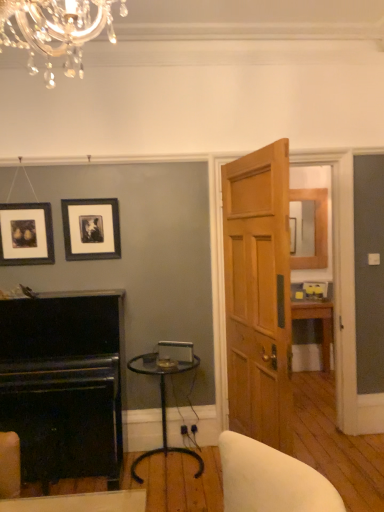
Question: Is matte black picture frame at upper left, the second picture frame positioned from the right, thinner than clear glass table at center?

Choices:
 (A) no
 (B) yes

Answer: (B)

Question: Does matte black picture frame at upper left, the second picture frame positioned from the right, have a greater height compared to clear glass table at center?

Choices:
 (A) yes
 (B) no

Answer: (B)

Question: Is the depth of matte black picture frame at upper left, the second picture frame positioned from the right, less than that of clear glass table at center?

Choices:
 (A) yes
 (B) no

Answer: (B)

Question: From the image's perspective, is matte black picture frame at upper left, the second picture frame positioned from the right, under clear glass table at center?

Choices:
 (A) no
 (B) yes

Answer: (A)

Question: Is matte black picture frame at upper left, the second picture frame positioned from the right, outside clear glass table at center?

Choices:
 (A) yes
 (B) no

Answer: (A)

Question: Is matte black picture frame at upper left, the second picture frame positioned from the right, further to the viewer compared to clear glass table at center?

Choices:
 (A) yes
 (B) no

Answer: (A)

Question: Is clear glass table at center positioned far away from matte black picture frame at upper left, the second picture frame positioned from the right?

Choices:
 (A) yes
 (B) no

Answer: (A)

Question: Does clear glass table at center have a greater width compared to matte black picture frame at upper left, arranged as the first picture frame when viewed from the left?

Choices:
 (A) no
 (B) yes

Answer: (B)

Question: Does clear glass table at center have a lesser width compared to matte black picture frame at upper left, arranged as the first picture frame when viewed from the left?

Choices:
 (A) yes
 (B) no

Answer: (B)

Question: Is clear glass table at center smaller than matte black picture frame at upper left, arranged as the first picture frame when viewed from the left?

Choices:
 (A) yes
 (B) no

Answer: (B)

Question: Is clear glass table at center beside matte black picture frame at upper left, arranged as the first picture frame when viewed from the left?

Choices:
 (A) yes
 (B) no

Answer: (B)

Question: Considering the relative sizes of clear glass table at center and matte black picture frame at upper left, arranged as the first picture frame when viewed from the left, in the image provided, is clear glass table at center taller than matte black picture frame at upper left, arranged as the first picture frame when viewed from the left,?

Choices:
 (A) yes
 (B) no

Answer: (A)

Question: Is light brown wooden door at center positioned behind black polished wood fireplace at lower left?

Choices:
 (A) no
 (B) yes

Answer: (A)